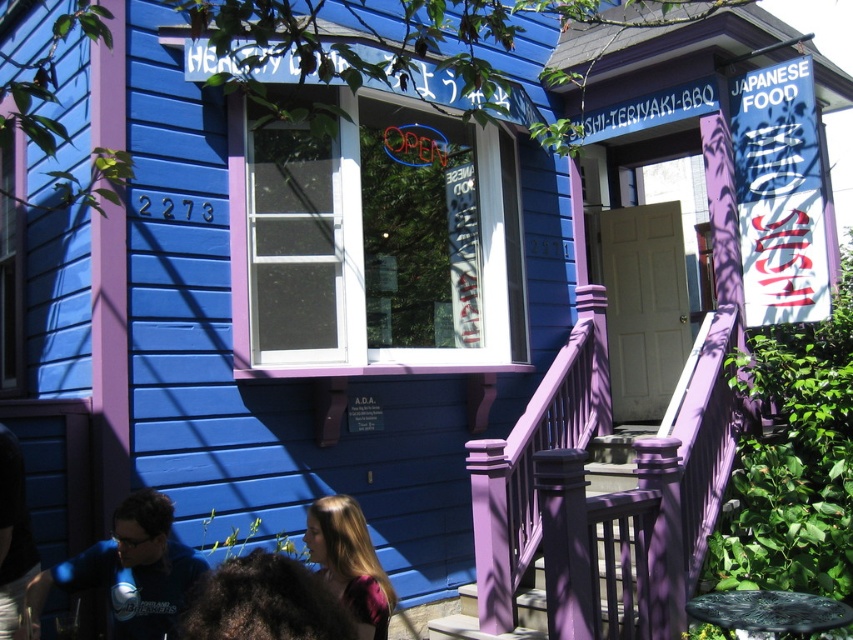
Between blue fabric shirt at lower left and dark curly hair at lower center, which one is positioned higher?

dark curly hair at lower center

Which of these two, blue fabric shirt at lower left or dark curly hair at lower center, stands taller?

blue fabric shirt at lower left is taller.

Between point (149, 624) and point (206, 592), which one is positioned in front?

Point (206, 592)

Locate an element on the screen. This screenshot has height=640, width=853. blue fabric shirt at lower left is located at coordinates (129, 570).

Based on the photo, is dark curly hair at lower center above blonde hair at lower center?

Correct, dark curly hair at lower center is located above blonde hair at lower center.

Does dark curly hair at lower center have a greater width compared to blonde hair at lower center?

Yes, dark curly hair at lower center is wider than blonde hair at lower center.

Who is more forward, (196, 628) or (379, 621)?

Positioned in front is point (196, 628).

This screenshot has width=853, height=640. Identify the location of dark curly hair at lower center. (263, 602).

Is blonde hair at lower center behind dark brown hair at lower left?

No, blonde hair at lower center is in front of dark brown hair at lower left.

Which of these two, blonde hair at lower center or dark brown hair at lower left, stands shorter?

With less height is blonde hair at lower center.

The height and width of the screenshot is (640, 853). What do you see at coordinates (349, 563) in the screenshot?
I see `blonde hair at lower center` at bounding box center [349, 563].

Image resolution: width=853 pixels, height=640 pixels. I want to click on blonde hair at lower center, so click(349, 563).